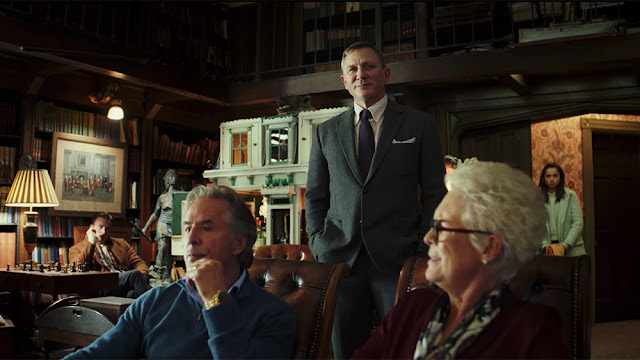
The height and width of the screenshot is (360, 640). Identify the location of table. (93, 279), (29, 283).